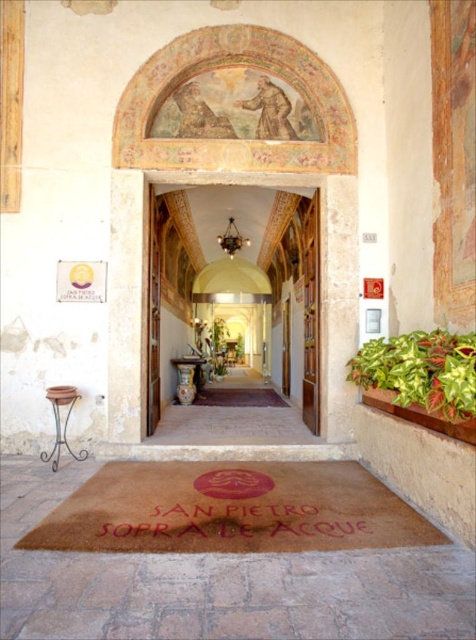
Question: Does brown coir mat at center appear under matte gold door at center?

Choices:
 (A) yes
 (B) no

Answer: (A)

Question: Which point is farther from the camera taking this photo?

Choices:
 (A) (444, 353)
 (B) (256, 236)

Answer: (B)

Question: Which point is closer to the camera?

Choices:
 (A) (167, 356)
 (B) (117, 481)
 (C) (79, 394)

Answer: (B)

Question: Which is farther from the brown matte doormat at center?

Choices:
 (A) matte gold door at center
 (B) brown coir mat at center

Answer: (B)

Question: Where is green variegated leaf at right located in relation to brown matte doormat at center in the image?

Choices:
 (A) left
 (B) right

Answer: (B)

Question: Can you confirm if brown coir mat at center is positioned to the right of matte gold door at center?

Choices:
 (A) yes
 (B) no

Answer: (A)